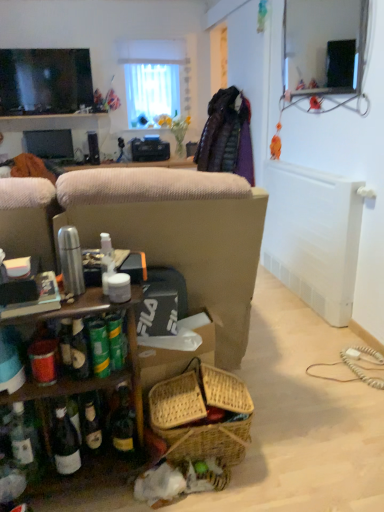
Question: From a real-world perspective, is matte black monitor at left, acting as the 2th television starting from the top, positioned above or below matte black tv at upper left, placed as the second television when sorted from bottom to top?

Choices:
 (A) below
 (B) above

Answer: (A)

Question: Considering the relative positions of matte black monitor at left, which appears as the first television when ordered from the bottom, and matte black tv at upper left, placed as the second television when sorted from bottom to top, in the image provided, is matte black monitor at left, which appears as the first television when ordered from the bottom, to the left or to the right of matte black tv at upper left, placed as the second television when sorted from bottom to top,?

Choices:
 (A) right
 (B) left

Answer: (B)

Question: Based on their relative distances, which object is farther from the matte black tv at upper left, placed as the second television when sorted from bottom to top?

Choices:
 (A) white sheer curtain at upper center
 (B) matte black monitor at left, which appears as the first television when viewed from the back

Answer: (A)

Question: Which object is the closest to the matte black monitor at left, which appears as the first television when ordered from the bottom?

Choices:
 (A) white sheer curtain at upper center
 (B) matte black tv at upper left, the second television viewed from the back

Answer: (B)